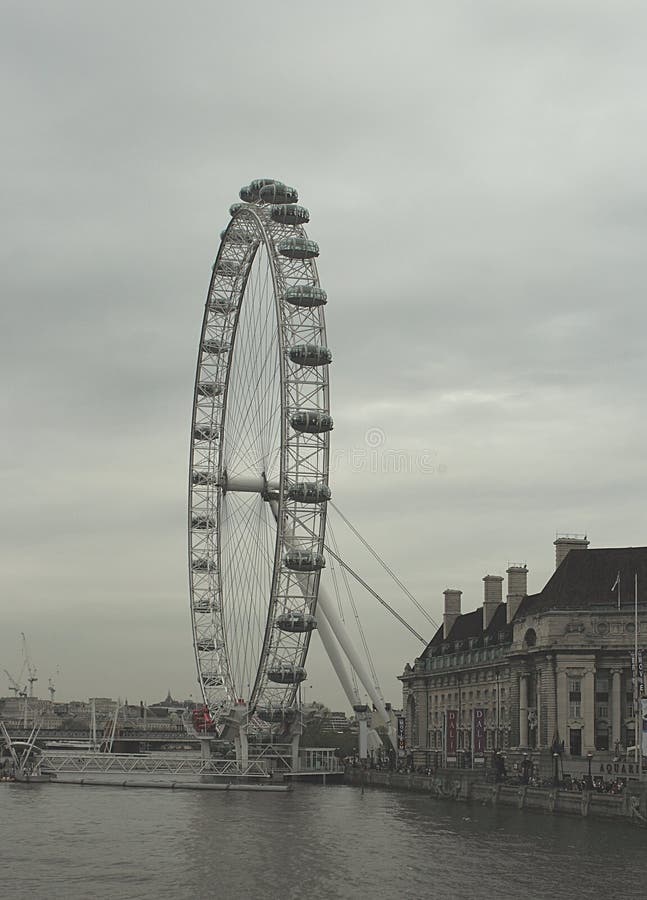
Locate an element on the screen. support beams is located at coordinates (331, 617), (332, 646).